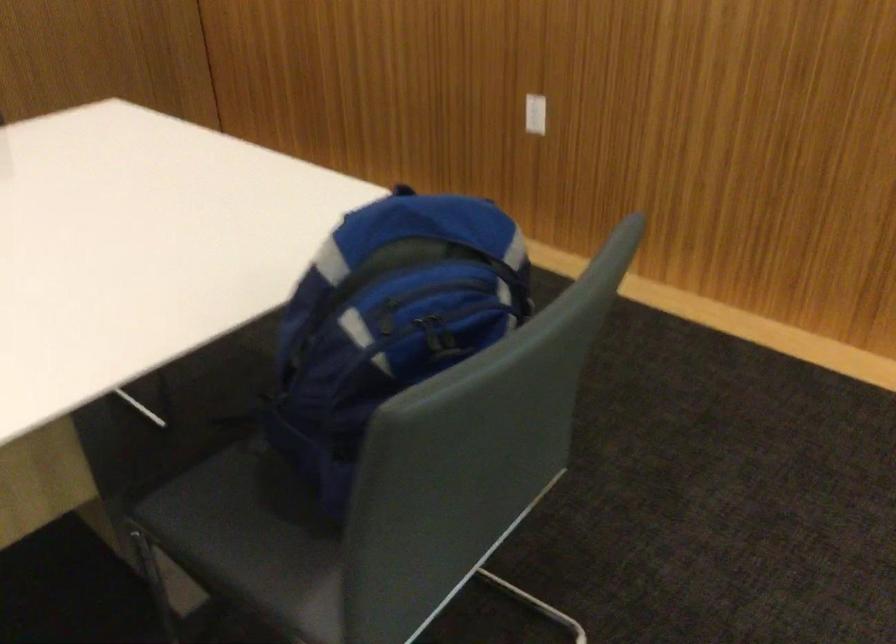
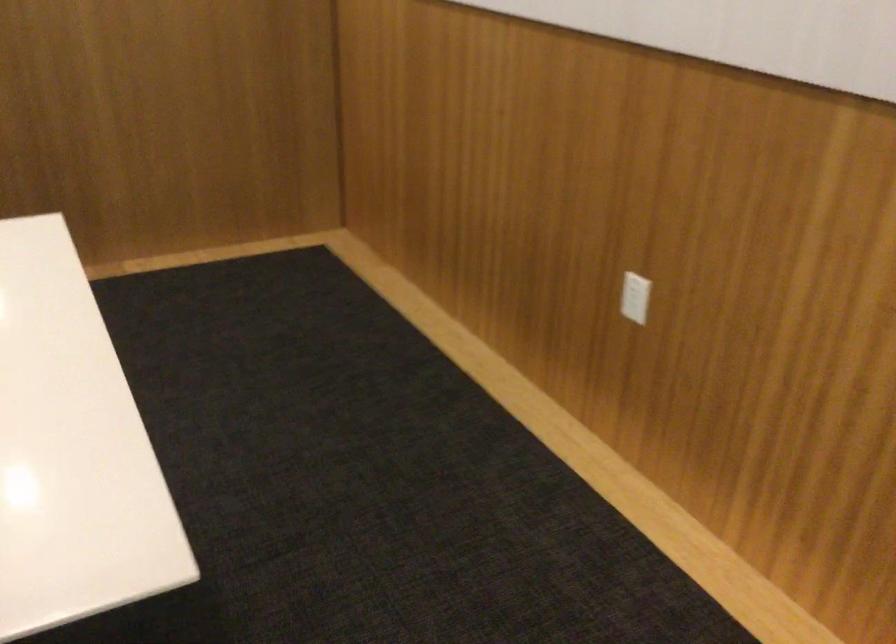
In the second image, find the point that corresponds to point 533,105 in the first image.

(634, 297)